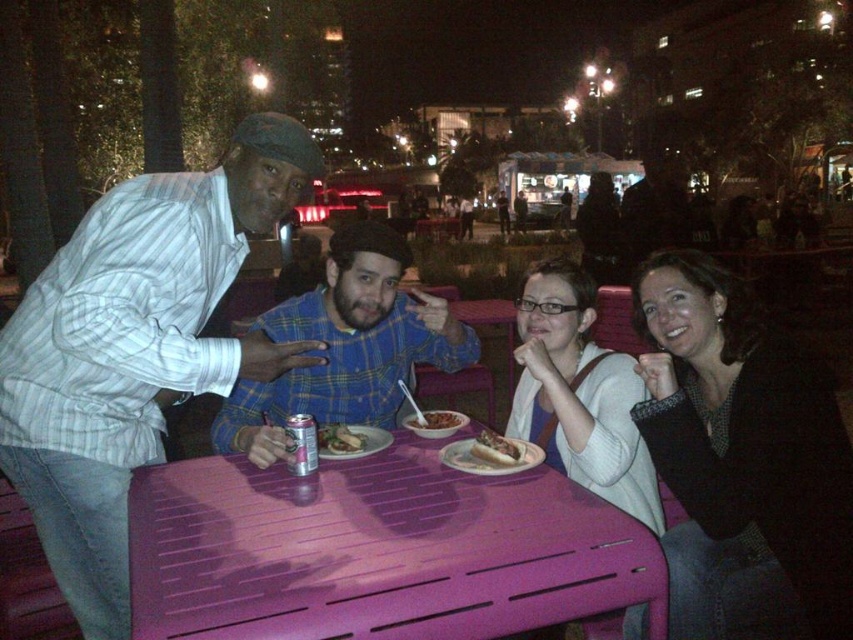
Question: Which of the following is the closest to the observer?

Choices:
 (A) shiny metallic can at table center
 (B) white sweater at center
 (C) smooth brown rice bowl at center
 (D) blue plaid shirt at center

Answer: (D)

Question: Which object is positioned closest to the matte black jacket at lower right?

Choices:
 (A) purple plastic table at center
 (B) shiny white hot dog at center
 (C) striped cotton shirt at left

Answer: (B)

Question: Which of these objects is positioned farthest from the blue plaid shirt at center?

Choices:
 (A) striped cotton shirt at left
 (B) smooth brown rice bowl at center
 (C) white sweater at center

Answer: (C)

Question: Can you confirm if shiny white hot dog at center is positioned to the left of shiny metallic can at table center?

Choices:
 (A) no
 (B) yes

Answer: (A)

Question: Is shiny metallic can at table center smaller than smooth brown rice bowl at center?

Choices:
 (A) no
 (B) yes

Answer: (A)

Question: Is purple plastic table at center to the left of white sweater at center from the viewer's perspective?

Choices:
 (A) yes
 (B) no

Answer: (A)